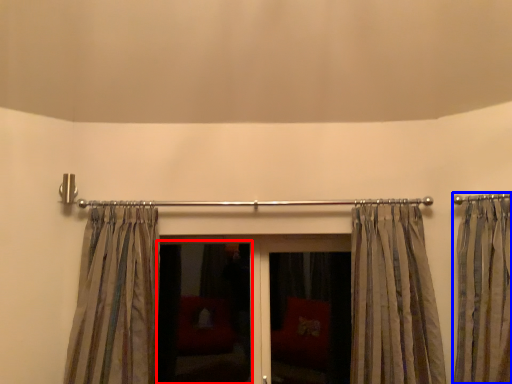
Question: Which object is further to the camera taking this photo, screen door (highlighted by a red box) or curtain (highlighted by a blue box)?

Choices:
 (A) screen door
 (B) curtain

Answer: (A)